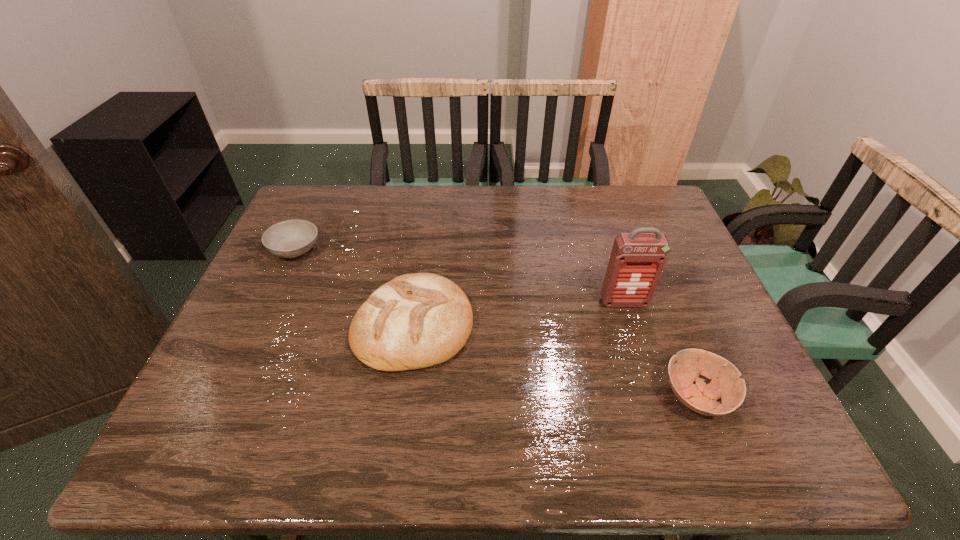
Locate an element on the screen. This screenshot has height=540, width=960. empty space between the left bowl and the right bowl is located at coordinates pos(495,323).

Identify which object is the second closest to the shorter bowl. Please provide its 2D coordinates. Your answer should be formatted as a tuple, i.e. [(x, y)], where the tuple contains the x and y coordinates of a point satisfying the conditions above.

[(637, 260)]

This screenshot has height=540, width=960. What are the coordinates of `object that is the third nearest to the bread` in the screenshot? It's located at (726, 384).

The height and width of the screenshot is (540, 960). Identify the location of blank space that satisfies the following two spatial constraints: 1. on the front-facing side of the nearer bowl; 2. on the right side of the tallest object. (654, 396).

I want to click on free space that satisfies the following two spatial constraints: 1. on the front side of the third object from right to left; 2. on the left side of the nearer bowl, so click(403, 396).

Identify the location of vacant area that satisfies the following two spatial constraints: 1. on the front side of the farthest object; 2. on the left side of the right bowl. This screenshot has width=960, height=540. (x=228, y=396).